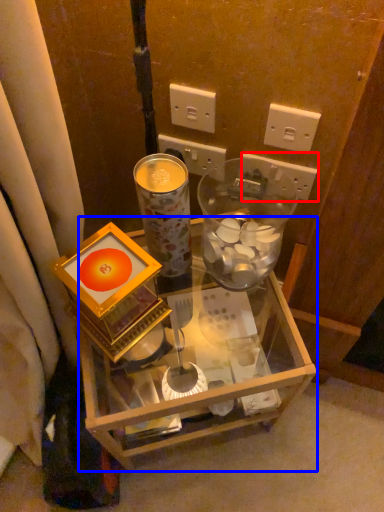
Question: Among these objects, which one is nearest to the camera, power outlet (highlighted by a red box) or desk (highlighted by a blue box)?

Choices:
 (A) power outlet
 (B) desk

Answer: (B)